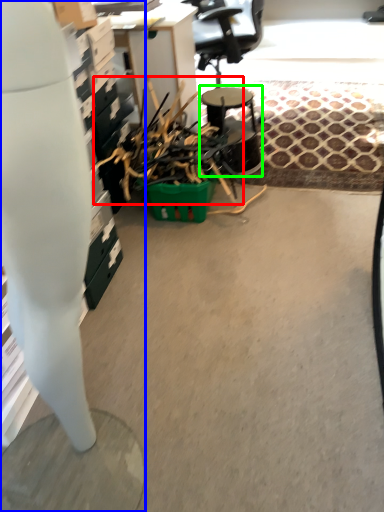
Question: Estimate the real-world distances between objects in this image. Which object is closer to debris (highlighted by a red box), desk (highlighted by a blue box) or round table (highlighted by a green box)?

Choices:
 (A) desk
 (B) round table

Answer: (B)